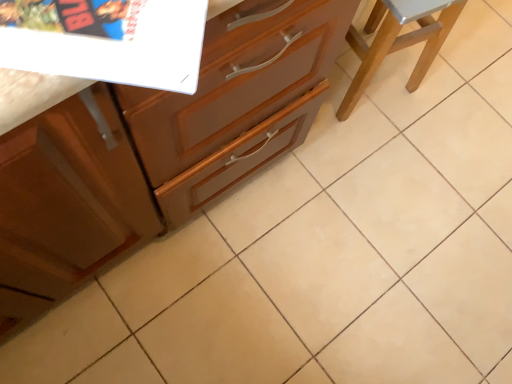
Question: Is wooden cabinet at center spatially inside wooden stool at right, or outside of it?

Choices:
 (A) inside
 (B) outside

Answer: (B)

Question: Considering the positions of wooden cabinet at center and wooden stool at right in the image, is wooden cabinet at center taller or shorter than wooden stool at right?

Choices:
 (A) tall
 (B) short

Answer: (B)

Question: Looking at the image, does wooden cabinet at center seem bigger or smaller compared to wooden stool at right?

Choices:
 (A) small
 (B) big

Answer: (B)

Question: From the image's perspective, is wooden stool at right positioned above or below wooden cabinet at center?

Choices:
 (A) above
 (B) below

Answer: (A)

Question: Would you say wooden stool at right is inside or outside wooden cabinet at center?

Choices:
 (A) outside
 (B) inside

Answer: (A)

Question: Considering the positions of wooden stool at right and wooden cabinet at center in the image, is wooden stool at right wider or thinner than wooden cabinet at center?

Choices:
 (A) wide
 (B) thin

Answer: (B)

Question: Considering the positions of point (439, 38) and point (204, 76), is point (439, 38) closer or farther from the camera than point (204, 76)?

Choices:
 (A) farther
 (B) closer

Answer: (A)